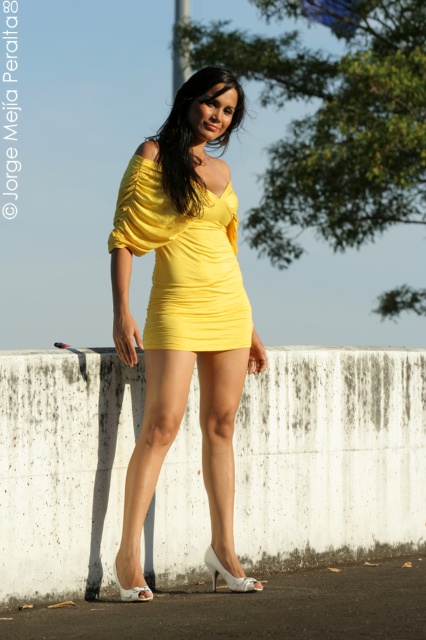
Question: Among these points, which one is farthest from the camera?

Choices:
 (A) (201, 108)
 (B) (158, 340)

Answer: (A)

Question: Is matte yellow dress at center below yellow matte dress at center?

Choices:
 (A) no
 (B) yes

Answer: (B)

Question: Among these points, which one is farthest from the camera?

Choices:
 (A) (163, 337)
 (B) (233, 340)

Answer: (B)

Question: Does matte yellow dress at center have a larger size compared to yellow matte dress at center?

Choices:
 (A) no
 (B) yes

Answer: (B)

Question: Where is matte yellow dress at center located in relation to yellow matte dress at center in the image?

Choices:
 (A) left
 (B) right

Answer: (B)

Question: Which point is closer to the camera taking this photo?

Choices:
 (A) tap(192, 353)
 (B) tap(201, 301)

Answer: (A)